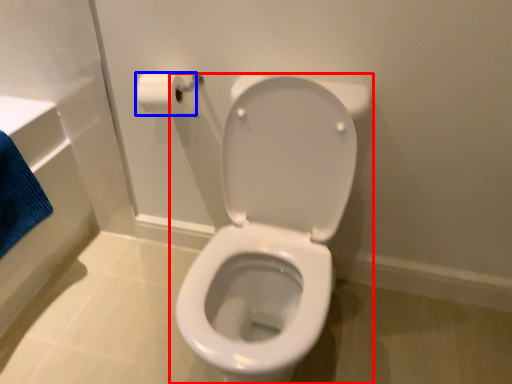
Question: Which point is closer to the camera, toilet (highlighted by a red box) or toilet paper (highlighted by a blue box)?

Choices:
 (A) toilet
 (B) toilet paper

Answer: (A)